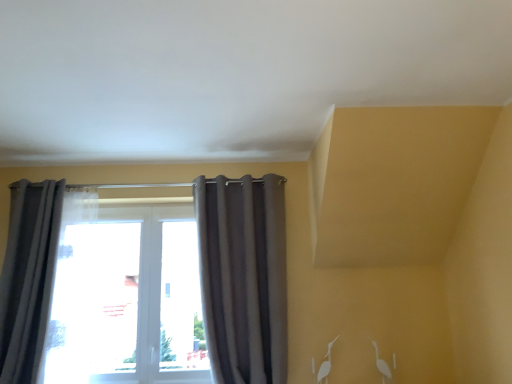
Question: From the image's perspective, is matte gray curtain at center, arranged as the 1th curtain when viewed from the right, beneath gray fabric curtain at left, which is counted as the 1th curtain, starting from the left?

Choices:
 (A) no
 (B) yes

Answer: (A)

Question: Does matte gray curtain at center, placed as the second curtain when sorted from left to right, turn towards gray fabric curtain at left, which is counted as the second curtain, starting from the right?

Choices:
 (A) yes
 (B) no

Answer: (B)

Question: Are matte gray curtain at center, arranged as the 1th curtain when viewed from the right, and gray fabric curtain at left, which is counted as the second curtain, starting from the right, beside each other?

Choices:
 (A) no
 (B) yes

Answer: (A)

Question: Considering the relative sizes of matte gray curtain at center, placed as the second curtain when sorted from left to right, and gray fabric curtain at left, which is counted as the second curtain, starting from the right, in the image provided, is matte gray curtain at center, placed as the second curtain when sorted from left to right, wider than gray fabric curtain at left, which is counted as the second curtain, starting from the right,?

Choices:
 (A) yes
 (B) no

Answer: (B)

Question: Is matte gray curtain at center, placed as the second curtain when sorted from left to right, bigger than gray fabric curtain at left, which is counted as the second curtain, starting from the right?

Choices:
 (A) yes
 (B) no

Answer: (B)

Question: Is matte gray curtain at center, placed as the second curtain when sorted from left to right, taller than gray fabric curtain at left, which is counted as the second curtain, starting from the right?

Choices:
 (A) yes
 (B) no

Answer: (A)

Question: Considering the relative sizes of gray fabric curtain at left, which is counted as the second curtain, starting from the right, and matte gray curtain at center, arranged as the 1th curtain when viewed from the right, in the image provided, is gray fabric curtain at left, which is counted as the second curtain, starting from the right, taller than matte gray curtain at center, arranged as the 1th curtain when viewed from the right,?

Choices:
 (A) yes
 (B) no

Answer: (B)

Question: Does gray fabric curtain at left, which is counted as the 1th curtain, starting from the left, have a lesser width compared to matte gray curtain at center, arranged as the 1th curtain when viewed from the right?

Choices:
 (A) yes
 (B) no

Answer: (B)

Question: Is gray fabric curtain at left, which is counted as the 1th curtain, starting from the left, completely or partially outside of matte gray curtain at center, placed as the second curtain when sorted from left to right?

Choices:
 (A) no
 (B) yes

Answer: (B)

Question: Can you confirm if gray fabric curtain at left, which is counted as the second curtain, starting from the right, is shorter than matte gray curtain at center, arranged as the 1th curtain when viewed from the right?

Choices:
 (A) no
 (B) yes

Answer: (B)

Question: Does gray fabric curtain at left, which is counted as the 1th curtain, starting from the left, turn towards matte gray curtain at center, arranged as the 1th curtain when viewed from the right?

Choices:
 (A) yes
 (B) no

Answer: (B)

Question: Is gray fabric curtain at left, which is counted as the second curtain, starting from the right, smaller than matte gray curtain at center, arranged as the 1th curtain when viewed from the right?

Choices:
 (A) no
 (B) yes

Answer: (A)

Question: Considering the relative positions of matte gray curtain at center, arranged as the 1th curtain when viewed from the right, and gray fabric curtain at left, which is counted as the 1th curtain, starting from the left, in the image provided, is matte gray curtain at center, arranged as the 1th curtain when viewed from the right, to the left or to the right of gray fabric curtain at left, which is counted as the 1th curtain, starting from the left,?

Choices:
 (A) right
 (B) left

Answer: (A)